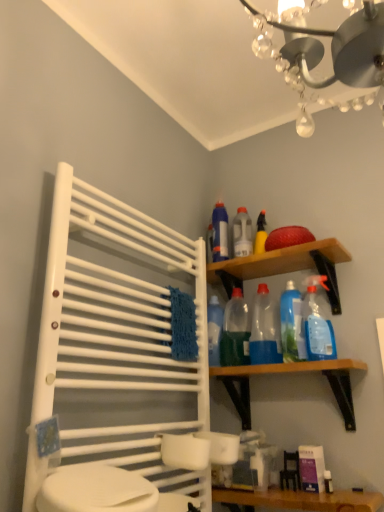
I want to click on blue plastic spray bottle at upper right, which appears as the 1th cleaning product when viewed from the left, so click(220, 233).

What do you see at coordinates (291, 324) in the screenshot? The height and width of the screenshot is (512, 384). I see `translucent plastic bottles at upper right, the 2th cleaning product in the right-to-left sequence` at bounding box center [291, 324].

What is the approximate width of white glossy toilet bowl at lower left?

white glossy toilet bowl at lower left is 7.13 inches wide.

Where is `translucent plastic bottle at upper center, which is the second bottle from bottom to top`? translucent plastic bottle at upper center, which is the second bottle from bottom to top is located at coordinates (242, 233).

Does translucent plastic bottle at upper center, which ranks as the second bottle in front-to-back order, come in front of translucent plastic bottle at center, which is counted as the first bottle, starting from the front?

No, translucent plastic bottle at upper center, which ranks as the second bottle in front-to-back order, is further to the viewer.

Is translucent plastic bottle at upper center, the 1th bottle in the back-to-front sequence, located outside translucent plastic bottle at center, which is the 2th bottle from back to front?

Indeed, translucent plastic bottle at upper center, the 1th bottle in the back-to-front sequence, is completely outside translucent plastic bottle at center, which is the 2th bottle from back to front.

Is the surface of translucent plastic bottle at upper center, which is counted as the first bottle, starting from the top, in direct contact with translucent plastic bottle at center, which is the 2th bottle from back to front?

No.

From the image's perspective, who appears lower, white glossy toilet bowl at lower left or wooden shelf at upper right, which ranks as the 2th shelf in top-to-bottom order?

white glossy toilet bowl at lower left, from the image's perspective.

Which object is wider, white glossy toilet bowl at lower left or wooden shelf at upper right, the 1th shelf in the bottom-to-top sequence?

Wider between the two is wooden shelf at upper right, the 1th shelf in the bottom-to-top sequence.

Between white glossy toilet bowl at lower left and wooden shelf at upper right, which ranks as the 2th shelf in top-to-bottom order, which one has larger size?

With larger size is wooden shelf at upper right, which ranks as the 2th shelf in top-to-bottom order.

Is white glossy toilet bowl at lower left oriented away from wooden shelf at upper right, the 1th shelf in the bottom-to-top sequence?

No, white glossy toilet bowl at lower left's orientation is not away from wooden shelf at upper right, the 1th shelf in the bottom-to-top sequence.

Would you say white glossy toilet bowl at lower left contains white plastic towel rack at left?

No.

Is white glossy toilet bowl at lower left to the left of white plastic towel rack at left from the viewer's perspective?

Indeed, white glossy toilet bowl at lower left is positioned on the left side of white plastic towel rack at left.

Considering the relative sizes of white glossy toilet bowl at lower left and white plastic towel rack at left in the image provided, is white glossy toilet bowl at lower left bigger than white plastic towel rack at left?

No.

Could you tell me if white glossy toilet bowl at lower left is turned towards white plastic towel rack at left?

No, white glossy toilet bowl at lower left is not facing towards white plastic towel rack at left.

From the image's perspective, is translucent plastic bottle at center, which is the 2th bottle from back to front, under transparent plastic bottles at upper center, the 2th cleaning product in the left-to-right sequence?

Correct, translucent plastic bottle at center, which is the 2th bottle from back to front, appears lower than transparent plastic bottles at upper center, the 2th cleaning product in the left-to-right sequence, in the image.

Considering the relative sizes of translucent plastic bottle at center, which is counted as the second bottle, starting from the top, and transparent plastic bottles at upper center, marked as the third cleaning product in a right-to-left arrangement, in the image provided, is translucent plastic bottle at center, which is counted as the second bottle, starting from the top, wider than transparent plastic bottles at upper center, marked as the third cleaning product in a right-to-left arrangement,?

No.

Can you confirm if translucent plastic bottle at center, which is counted as the first bottle, starting from the front, is taller than transparent plastic bottles at upper center, marked as the third cleaning product in a right-to-left arrangement?

In fact, translucent plastic bottle at center, which is counted as the first bottle, starting from the front, may be shorter than transparent plastic bottles at upper center, marked as the third cleaning product in a right-to-left arrangement.

Could you tell me if translucent plastic bottle at center, which is counted as the first bottle, starting from the front, is turned towards transparent plastic bottles at upper center, the 2th cleaning product in the left-to-right sequence?

No, translucent plastic bottle at center, which is counted as the first bottle, starting from the front, is not facing towards transparent plastic bottles at upper center, the 2th cleaning product in the left-to-right sequence.

From the image's perspective, is blue plastic spray bottle at upper right, which appears as the 1th cleaning product when viewed from the left, below wooden vanity at lower center?

Actually, blue plastic spray bottle at upper right, which appears as the 1th cleaning product when viewed from the left, appears above wooden vanity at lower center in the image.

Between blue plastic spray bottle at upper right, which is counted as the fourth cleaning product, starting from the right, and wooden vanity at lower center, which one has larger size?

wooden vanity at lower center.

Is blue plastic spray bottle at upper right, which appears as the 1th cleaning product when viewed from the left, wider or thinner than wooden vanity at lower center?

In the image, blue plastic spray bottle at upper right, which appears as the 1th cleaning product when viewed from the left, appears to be more narrow than wooden vanity at lower center.

Considering the relative positions of blue plastic spray bottle at upper right, which is counted as the fourth cleaning product, starting from the right, and wooden vanity at lower center in the image provided, is blue plastic spray bottle at upper right, which is counted as the fourth cleaning product, starting from the right, to the left of wooden vanity at lower center from the viewer's perspective?

Yes, blue plastic spray bottle at upper right, which is counted as the fourth cleaning product, starting from the right, is to the left of wooden vanity at lower center.

Identify the location of bottle located above the translucent plastic bottle at center, which is counted as the first bottle, starting from the front (from the image's perspective). The width and height of the screenshot is (384, 512). (242, 233).

Can you confirm if translucent plastic bottle at center, which is counted as the first bottle, starting from the front, is taller than translucent plastic bottle at upper center, which is counted as the first bottle, starting from the top?

Yes, translucent plastic bottle at center, which is counted as the first bottle, starting from the front, is taller than translucent plastic bottle at upper center, which is counted as the first bottle, starting from the top.

Considering the relative positions of translucent plastic bottle at center, positioned as the 1th bottle in bottom-to-top order, and translucent plastic bottle at upper center, the 1th bottle in the back-to-front sequence, in the image provided, is translucent plastic bottle at center, positioned as the 1th bottle in bottom-to-top order, to the left of translucent plastic bottle at upper center, the 1th bottle in the back-to-front sequence, from the viewer's perspective?

Yes.

Considering the relative sizes of translucent plastic bottle at center, which is counted as the first bottle, starting from the front, and translucent plastic bottle at upper center, which is counted as the first bottle, starting from the top, in the image provided, is translucent plastic bottle at center, which is counted as the first bottle, starting from the front, smaller than translucent plastic bottle at upper center, which is counted as the first bottle, starting from the top,?

Actually, translucent plastic bottle at center, which is counted as the first bottle, starting from the front, might be larger than translucent plastic bottle at upper center, which is counted as the first bottle, starting from the top.

Where is `toilet bowl on the left side of wooden vanity at lower center`? This screenshot has height=512, width=384. toilet bowl on the left side of wooden vanity at lower center is located at coordinates (96, 490).

Looking at their sizes, would you say white glossy toilet bowl at lower left is wider or thinner than wooden vanity at lower center?

Considering their sizes, white glossy toilet bowl at lower left looks slimmer than wooden vanity at lower center.

Between white glossy toilet bowl at lower left and wooden vanity at lower center, which one has smaller size?

white glossy toilet bowl at lower left.

Find the location of `bottle that is below the translucent plastic bottle at upper center, the 1th bottle in the back-to-front sequence (from the image's perspective)`. bottle that is below the translucent plastic bottle at upper center, the 1th bottle in the back-to-front sequence (from the image's perspective) is located at coordinates (235, 332).

Where is `toilet bowl that appears below the wooden shelf at upper right, which ranks as the 2th shelf in top-to-bottom order (from a real-world perspective)`? toilet bowl that appears below the wooden shelf at upper right, which ranks as the 2th shelf in top-to-bottom order (from a real-world perspective) is located at coordinates (96, 490).

Looking at the image, which one is located further to wooden shelf at upper right, the first shelf when ordered from top to bottom, blue plastic spray bottle at upper right, which appears as the 1th cleaning product when viewed from the left, or wooden shelf at upper right, which ranks as the 2th shelf in top-to-bottom order?

wooden shelf at upper right, which ranks as the 2th shelf in top-to-bottom order, is positioned further to the anchor wooden shelf at upper right, the first shelf when ordered from top to bottom.

From the image, which object appears to be farther from translucent plastic bottle at upper center, which is the second bottle from bottom to top, wooden shelf at upper right, the first shelf when ordered from top to bottom, or white glossy toilet bowl at lower left?

The object further to translucent plastic bottle at upper center, which is the second bottle from bottom to top, is white glossy toilet bowl at lower left.

From the image, which object appears to be farther from translucent plastic bottle at center, which is counted as the second bottle, starting from the top, wooden vanity at lower center or white glossy toilet bowl at lower left?

white glossy toilet bowl at lower left is further to translucent plastic bottle at center, which is counted as the second bottle, starting from the top.

Considering their positions, is blue plastic spray bottle at upper right, which is counted as the fourth cleaning product, starting from the right, positioned further to translucent plastic bottle at upper center, which ranks as the second bottle in front-to-back order, than wooden vanity at lower center?

wooden vanity at lower center is positioned further to the anchor translucent plastic bottle at upper center, which ranks as the second bottle in front-to-back order.

Looking at the image, which one is located closer to white plastic towel rack at left, blue plastic spray bottle at upper right, which is counted as the fourth cleaning product, starting from the right, or translucent plastic spray bottle at upper right, which ranks as the fourth cleaning product in left-to-right order?

The object closer to white plastic towel rack at left is blue plastic spray bottle at upper right, which is counted as the fourth cleaning product, starting from the right.

When comparing their distances from translucent plastic spray bottle at upper right, which ranks as the fourth cleaning product in left-to-right order, does wooden shelf at upper right, which ranks as the 2th shelf in top-to-bottom order, or white glossy toilet bowl at lower left seem closer?

wooden shelf at upper right, which ranks as the 2th shelf in top-to-bottom order.

Which object lies further to the anchor point wooden shelf at upper right, which ranks as the 2th shelf in top-to-bottom order, wooden shelf at upper right, which is the 2th shelf from bottom to top, or translucent plastic bottle at center, which is the 2th bottle from back to front?

The object further to wooden shelf at upper right, which ranks as the 2th shelf in top-to-bottom order, is wooden shelf at upper right, which is the 2th shelf from bottom to top.

Based on their spatial positions, is translucent plastic bottle at upper center, the 1th bottle in the back-to-front sequence, or blue plastic spray bottle at upper right, which is counted as the fourth cleaning product, starting from the right, closer to translucent plastic bottles at upper right, the 2th cleaning product in the right-to-left sequence?

translucent plastic bottle at upper center, the 1th bottle in the back-to-front sequence, is positioned closer to the anchor translucent plastic bottles at upper right, the 2th cleaning product in the right-to-left sequence.

This screenshot has height=512, width=384. In order to click on cleaning product that lies between translucent plastic bottles at upper right, which is the third cleaning product from left to right, and wooden shelf at upper right, which ranks as the 2th shelf in top-to-bottom order, from top to bottom in this screenshot , I will do `click(265, 329)`.

Where is `cabinet between translucent plastic spray bottle at upper right, which ranks as the fourth cleaning product in left-to-right order, and wooden vanity at lower center, in the vertical direction`? cabinet between translucent plastic spray bottle at upper right, which ranks as the fourth cleaning product in left-to-right order, and wooden vanity at lower center, in the vertical direction is located at coordinates (114, 348).

Locate an element on the screen. This screenshot has height=512, width=384. vanity located between white plastic towel rack at left and translucent plastic bottle at center, which is counted as the first bottle, starting from the front, in the depth direction is located at coordinates (298, 500).

You are a GUI agent. You are given a task and a screenshot of the screen. Output one action in this format:
    pyautogui.click(x=<x>, y=<y>)
    Task: Click on the shelf between white plastic towel rack at left and wooden vanity at lower center from top to bottom
    
    Given the screenshot: What is the action you would take?
    pyautogui.click(x=289, y=373)